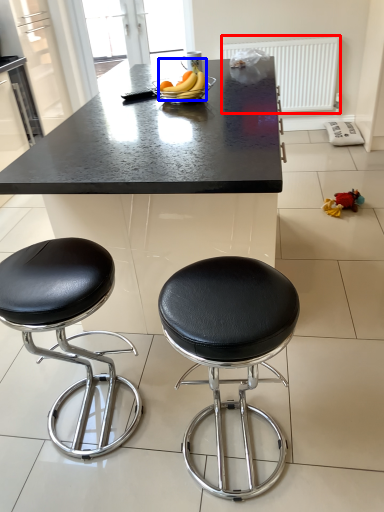
Question: Which point is further to the camera, radiator (highlighted by a red box) or banana (highlighted by a blue box)?

Choices:
 (A) radiator
 (B) banana

Answer: (A)